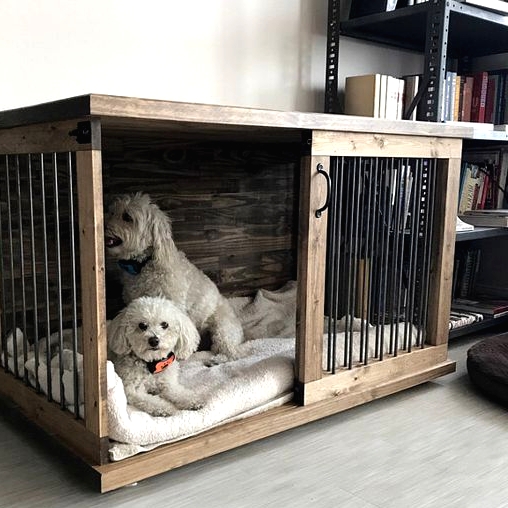
The image size is (508, 508). Find the location of `books'`. books' is located at coordinates (468, 100), (493, 94), (492, 189), (388, 101).